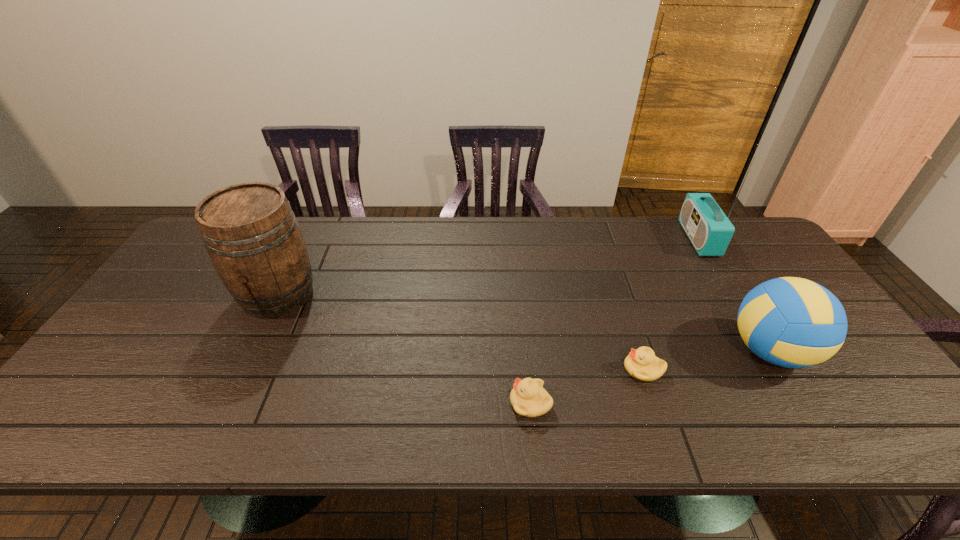
Locate an element on the screen. The image size is (960, 540). radio receiver is located at coordinates (708, 228).

Locate an element on the screen. Image resolution: width=960 pixels, height=540 pixels. the leftmost object is located at coordinates (251, 234).

This screenshot has width=960, height=540. I want to click on volleyball, so click(791, 322).

Where is `the fourth object from right to left`? The width and height of the screenshot is (960, 540). the fourth object from right to left is located at coordinates [x=528, y=397].

The image size is (960, 540). I want to click on the right duckling, so click(642, 364).

Where is `free spot located 0.060m on the front panel of the farthest object`? The height and width of the screenshot is (540, 960). free spot located 0.060m on the front panel of the farthest object is located at coordinates (667, 239).

Locate an element on the screen. The width and height of the screenshot is (960, 540). vacant space located 0.280m on the front panel of the farthest object is located at coordinates (601, 239).

Where is `free space located 0.240m on the front panel of the farthest object`? free space located 0.240m on the front panel of the farthest object is located at coordinates (612, 239).

Image resolution: width=960 pixels, height=540 pixels. I want to click on vacant space located on the side of the cider near the bung hole, so click(225, 404).

At what (x,y) coordinates should I click in order to perform the action: click on vacant point located on the back of the volleyball. Please return your answer as a coordinate pair (x, y). Image resolution: width=960 pixels, height=540 pixels. Looking at the image, I should click on (704, 243).